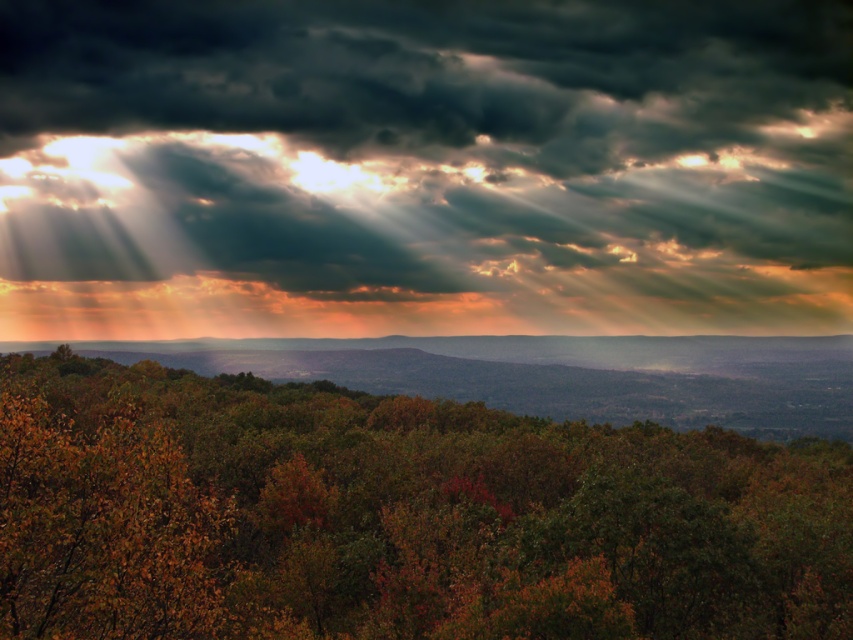
You are an observer looking at the landscape. Which object, the dark gray cloud at upper center or the green matte tree at center, occupies a bigger area in the scene?

The dark gray cloud at upper center has a larger size compared to the green matte tree at center, so it occupies a bigger area in the scene.

You are an observer looking at the landscape. You notice the dark gray cloud at upper center and the green matte tree at center. Which object is located to the left of the other?

The dark gray cloud at upper center is positioned on the left side of green matte tree at center.

You are a bird flying at an altitude of 50 meters above the green matte tree at center. How far vertically above you is the dark gray cloud at upper center?

The dark gray cloud at upper center is 114.17 meters from the green matte tree at center. Since you are flying 50 meters above the tree, the vertical distance between you and the cloud is 114.17 meters minus 50 meters, which equals 64.17 meters.